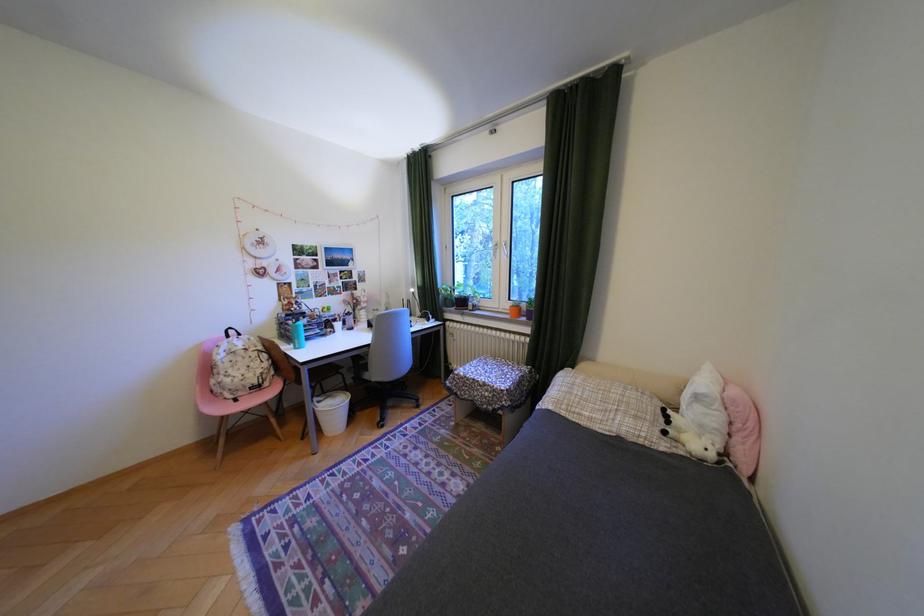
What do you see at coordinates (231, 331) in the screenshot?
I see `the backpack handle` at bounding box center [231, 331].